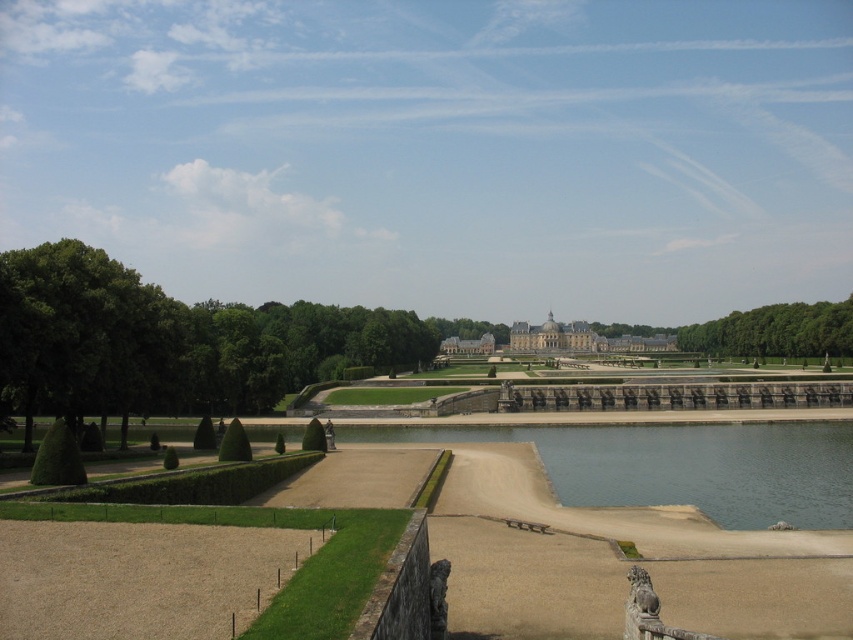
Question: Which object appears closest to the camera in this image?

Choices:
 (A) green leafy tree at left
 (B) stone gray palace at center
 (C) matte stone palace at center

Answer: (A)

Question: Does green leafy tree at left appear over stone gray palace at center?

Choices:
 (A) yes
 (B) no

Answer: (A)

Question: Which object is the farthest from the matte stone palace at center?

Choices:
 (A) green leafy tree at center
 (B) green leafy hedge at lower left
 (C) green leafy tree at left

Answer: (B)

Question: Based on their relative distances, which object is nearer to the matte stone palace at center?

Choices:
 (A) green leafy tree at left
 (B) green leafy tree at center

Answer: (B)

Question: Is green leafy hedge at lower left thinner than stone gray palace at center?

Choices:
 (A) no
 (B) yes

Answer: (B)

Question: In this image, where is green leafy tree at left located relative to matte stone palace at center?

Choices:
 (A) left
 (B) right

Answer: (A)